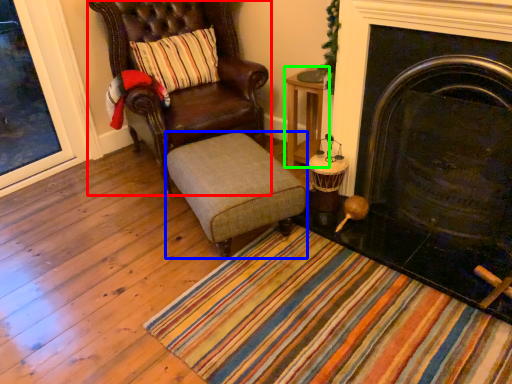
Question: Which is nearer to the chair (highlighted by a red box)? stool (highlighted by a blue box) or table (highlighted by a green box).

Choices:
 (A) stool
 (B) table

Answer: (A)